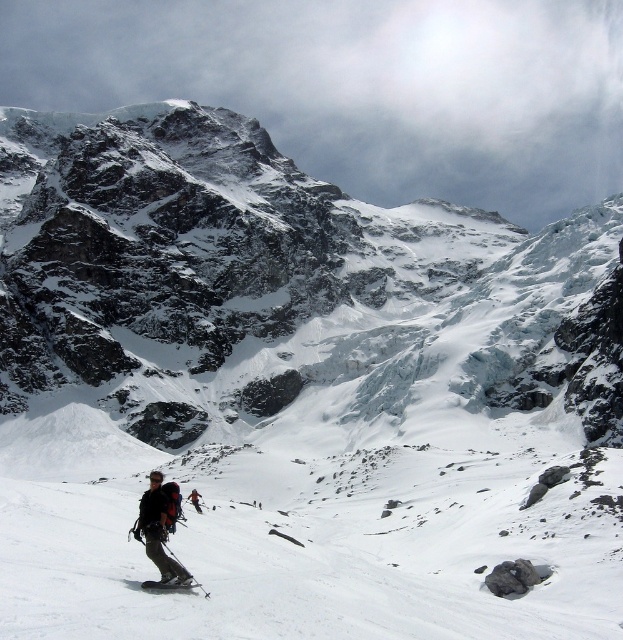
Consider the image. What is the spatial relationship between the dark gray fabric backpack at lower center and the black matte ski at lower center?

The black matte ski at lower center is behind the dark gray fabric backpack at lower center.